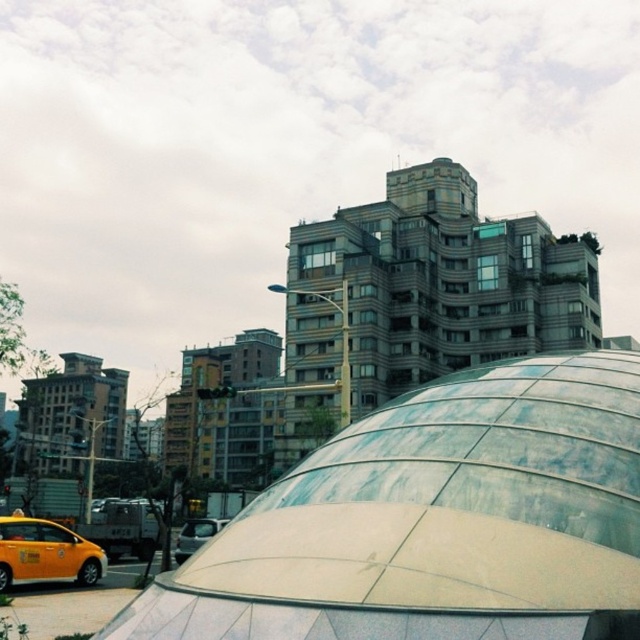
Question: Which object is farther from the camera taking this photo?

Choices:
 (A) transparent glass dome at center
 (B) yellow matte taxi at lower left
 (C) silver metallic van at center

Answer: (C)

Question: Does transparent glass dome at center have a larger size compared to silver metallic van at center?

Choices:
 (A) no
 (B) yes

Answer: (B)

Question: Estimate the real-world distances between objects in this image. Which object is farther from the transparent glass dome at center?

Choices:
 (A) yellow matte taxi at lower left
 (B) silver metallic van at center

Answer: (B)

Question: Does transparent glass dome at center come behind silver metallic van at center?

Choices:
 (A) yes
 (B) no

Answer: (B)

Question: Considering the relative positions of yellow matte taxi at lower left and silver metallic van at center in the image provided, where is yellow matte taxi at lower left located with respect to silver metallic van at center?

Choices:
 (A) right
 (B) left

Answer: (B)

Question: Among these objects, which one is farthest from the camera?

Choices:
 (A) transparent glass dome at center
 (B) silver metallic van at center
 (C) yellow matte taxi at lower left

Answer: (B)